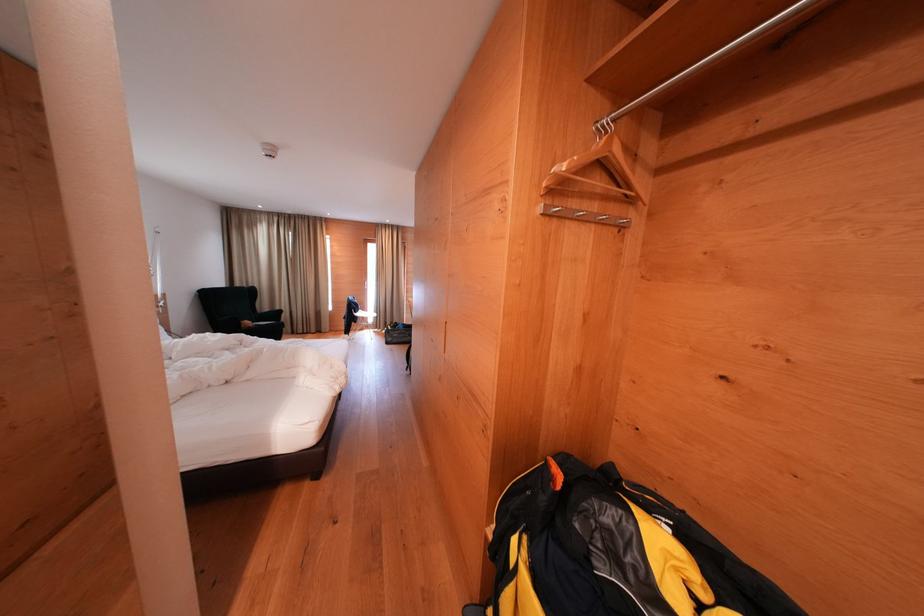
Find the location of `black chair sitting surface`. black chair sitting surface is located at coordinates (263, 325).